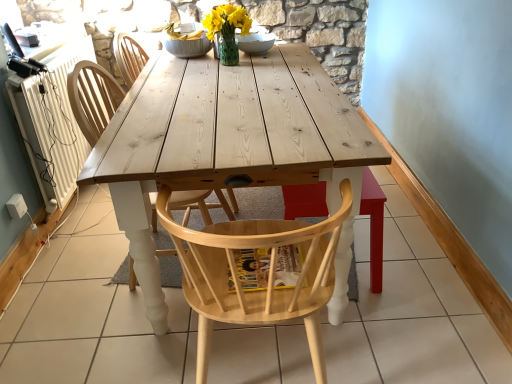
This screenshot has width=512, height=384. Find the location of `vacant space situated on the left part of natural wood chair at center, the second chair when ordered from front to back`. vacant space situated on the left part of natural wood chair at center, the second chair when ordered from front to back is located at coordinates (84, 264).